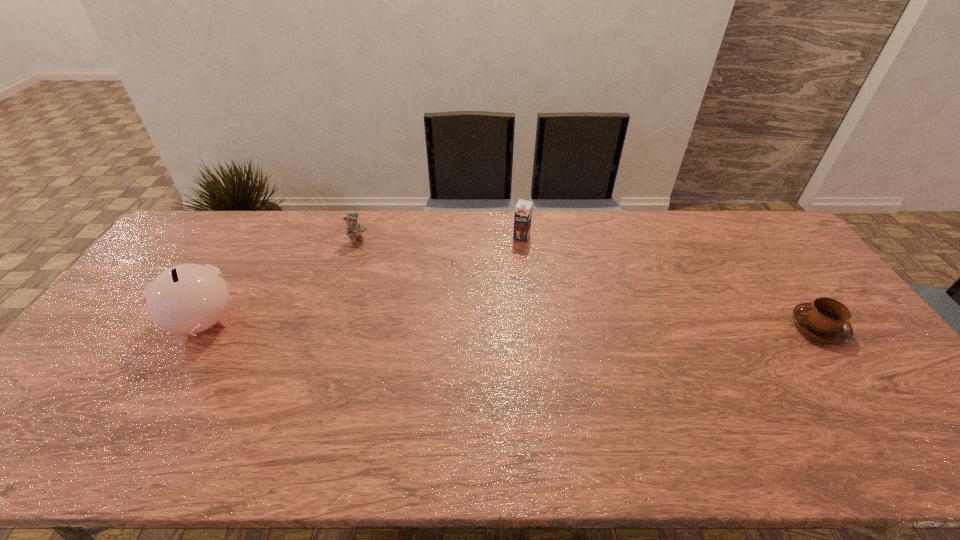
Find the location of a particular element. This screenshot has height=540, width=960. vacant space that is in between the leftmost object and the third shortest object is located at coordinates (363, 280).

Identify the location of empty space that is in between the teddy bear and the chocolate milk. The width and height of the screenshot is (960, 540). (440, 240).

Find the location of a particular element. empty space between the teddy bear and the leftmost object is located at coordinates (281, 283).

I want to click on empty location between the third shortest object and the second object from left to right, so click(x=440, y=240).

Locate an element on the screen. free space between the leftmost object and the second object from right to left is located at coordinates (363, 280).

This screenshot has height=540, width=960. Identify the location of the closest object to the third tallest object. (185, 299).

This screenshot has height=540, width=960. I want to click on the closest object to the third object from right to left, so click(x=185, y=299).

This screenshot has height=540, width=960. Find the location of `blank space that satisfies the following two spatial constraints: 1. on the front side of the cappuccino; 2. on the side of the tallest object with the handle`. blank space that satisfies the following two spatial constraints: 1. on the front side of the cappuccino; 2. on the side of the tallest object with the handle is located at coordinates (201, 327).

The width and height of the screenshot is (960, 540). Identify the location of free spot that satisfies the following two spatial constraints: 1. on the front side of the cappuccino; 2. on the side of the teddy bear with the handle. (331, 327).

Image resolution: width=960 pixels, height=540 pixels. Find the location of `free region that satisfies the following two spatial constraints: 1. on the front side of the cappuccino; 2. on the side of the leftmost object with the handle`. free region that satisfies the following two spatial constraints: 1. on the front side of the cappuccino; 2. on the side of the leftmost object with the handle is located at coordinates (201, 327).